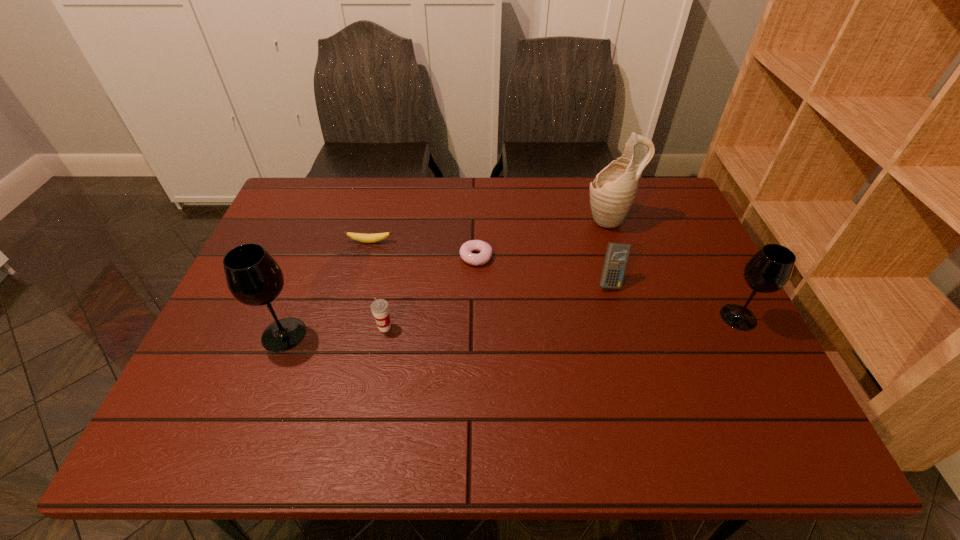
The width and height of the screenshot is (960, 540). I want to click on unoccupied area between the sixth nearest object and the pitcher, so click(x=490, y=231).

Locate an element on the screen. The height and width of the screenshot is (540, 960). vacant region between the rightmost object and the pitcher is located at coordinates (674, 268).

Where is `unoccupied area between the taller wineglass and the calculator`? unoccupied area between the taller wineglass and the calculator is located at coordinates (447, 308).

This screenshot has width=960, height=540. What are the coordinates of `vacant area between the fourth object from left to right and the pitcher` in the screenshot? It's located at (542, 238).

Find the location of a particular element. vacant space that's between the leftmost object and the farthest object is located at coordinates (446, 277).

At what (x,y) coordinates should I click in order to perform the action: click on free area in between the cup and the shorter wineglass. Please return your answer as a coordinate pair (x, y). Looking at the image, I should click on (562, 322).

Find the location of `free area in between the cup and the fourth object from right to left`. free area in between the cup and the fourth object from right to left is located at coordinates (430, 292).

At what (x,y) coordinates should I click in order to perform the action: click on free spot between the banana and the fourth object from right to left. Please return your answer as a coordinate pair (x, y). Looking at the image, I should click on (423, 249).

Identify which object is the second closest to the calculator. Please provide its 2D coordinates. Your answer should be formatted as a tuple, i.e. [(x, y)], where the tuple contains the x and y coordinates of a point satisfying the conditions above.

[(769, 270)]

Select which object appears as the closest to the taller wineglass. Please provide its 2D coordinates. Your answer should be formatted as a tuple, i.e. [(x, y)], where the tuple contains the x and y coordinates of a point satisfying the conditions above.

[(380, 308)]